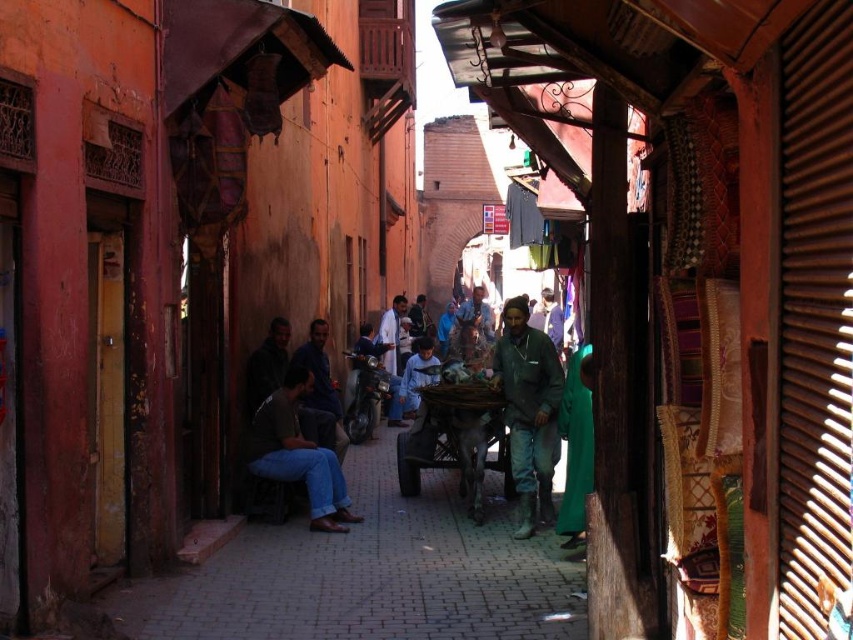
Does point (273, 417) lie behind point (401, 305)?

That is False.

Does dark brown leather shoes at lower center appear on the left side of white clothed man at center?

Indeed, dark brown leather shoes at lower center is positioned on the left side of white clothed man at center.

Who is more forward, [332,460] or [393,314]?

Point [332,460] is in front.

Identify the location of dark brown leather shoes at lower center. (299, 454).

Which is more to the right, dark blue jeans at center or dark brown leather jacket at center?

From the viewer's perspective, dark blue jeans at center appears more on the right side.

What do you see at coordinates (320, 392) in the screenshot?
I see `dark blue jeans at center` at bounding box center [320, 392].

I want to click on dark blue jeans at center, so (320, 392).

Which of these two, dark brown leather jacket at center or white clothed man at center, stands taller?

dark brown leather jacket at center

Is dark brown leather jacket at center thinner than white clothed man at center?

No, dark brown leather jacket at center is not thinner than white clothed man at center.

Does point (270, 348) lie behind point (402, 417)?

No.

Identify the location of dark brown leather jacket at center. (265, 364).